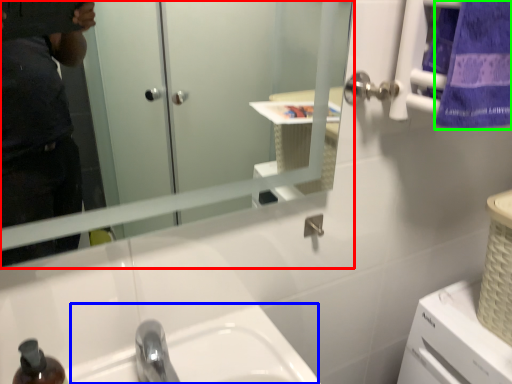
Question: Which is farther away from mirror (highlighted by a red box)? sink (highlighted by a blue box) or towel/napkin (highlighted by a green box)?

Choices:
 (A) sink
 (B) towel/napkin

Answer: (A)